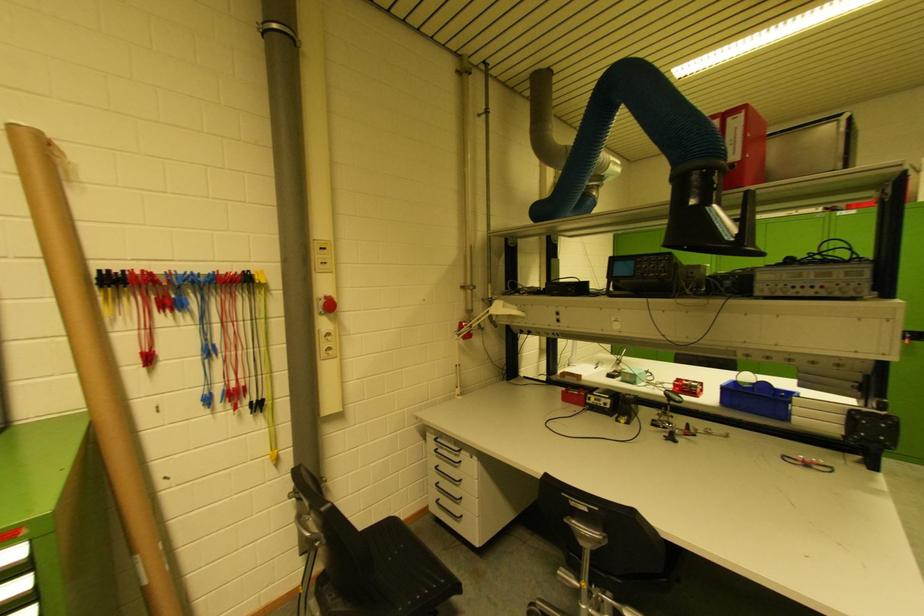
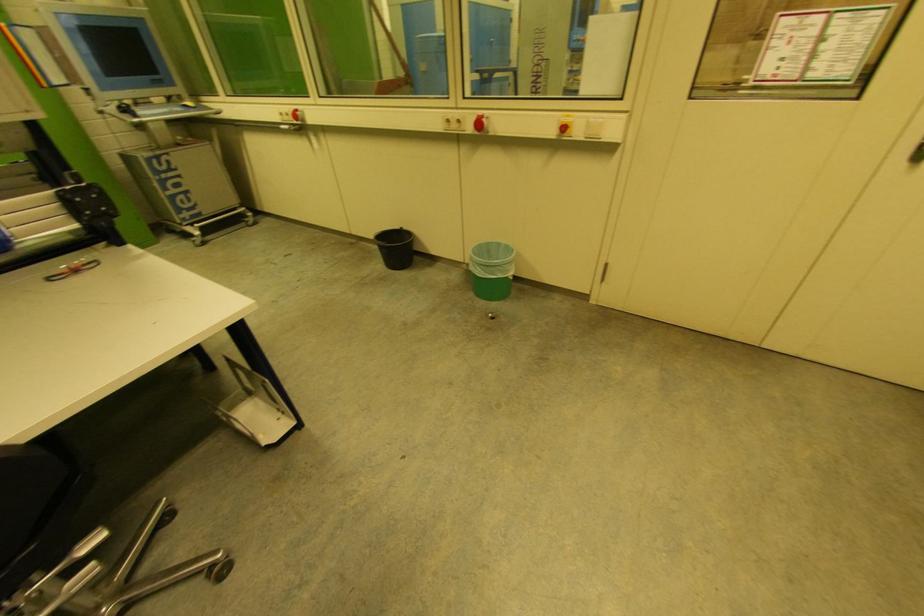
How did the camera likely rotate?

The camera's rotation is toward right-down.